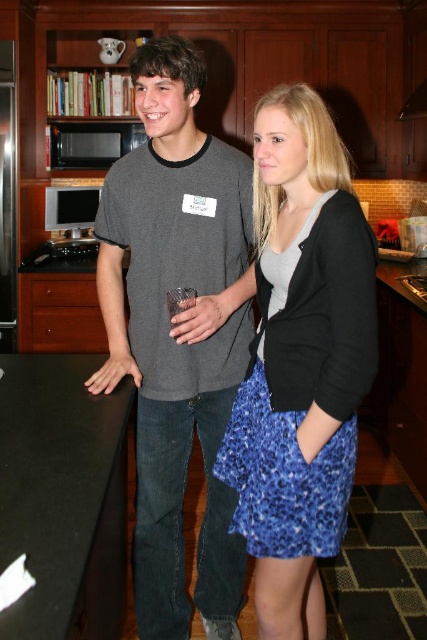
Can you confirm if blue floral skirt at center is bigger than black matte exhaust hood at upper center?

Correct, blue floral skirt at center is larger in size than black matte exhaust hood at upper center.

Is blue floral skirt at center smaller than black matte exhaust hood at upper center?

No, blue floral skirt at center is not smaller than black matte exhaust hood at upper center.

Measure the distance between point (x=365, y=312) and camera.

They are 3.80 feet apart.

Where is `blue floral skirt at center`? The image size is (427, 640). blue floral skirt at center is located at coordinates (301, 360).

Can you confirm if dark gray t-shirt at center is thinner than black matte exhaust hood at upper center?

No.

Does point (178, 180) lie in front of point (424, 108)?

Yes, it is in front of point (424, 108).

What are the coordinates of `dark gray t-shirt at center` in the screenshot? It's located at (178, 333).

From the picture: Is black laminate counter top at left to the left of black matte exhaust hood at upper center from the viewer's perspective?

Yes, black laminate counter top at left is to the left of black matte exhaust hood at upper center.

Identify the location of black laminate counter top at left. (63, 496).